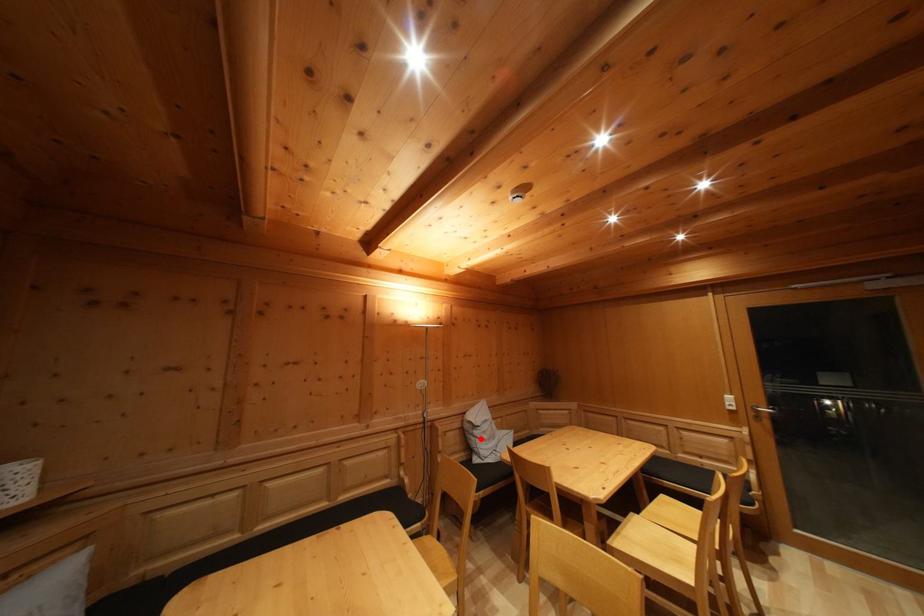
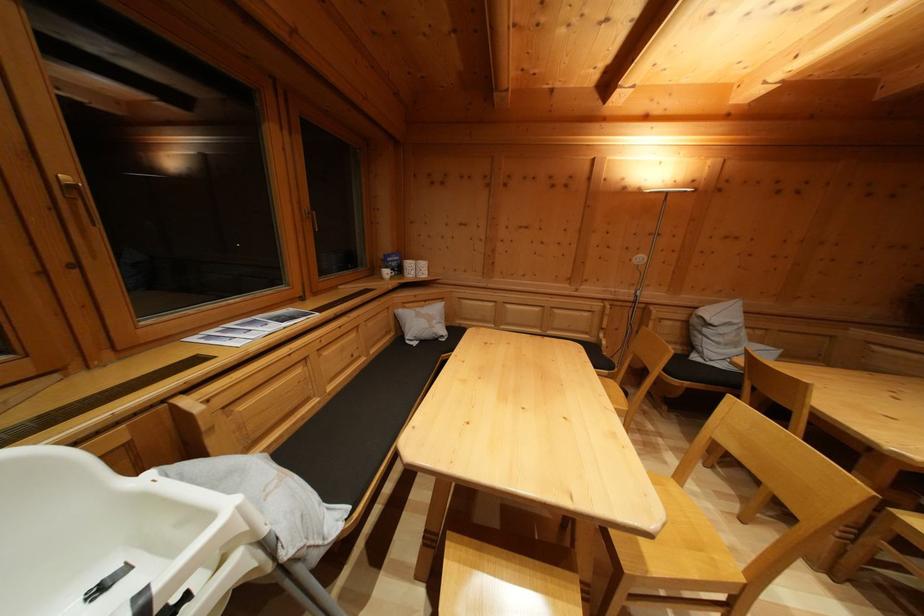
Question: I am providing you with two images of the same scene from different viewpoints. In image1, a red point is highlighted. Considering the same 3D point in image2, which of the following is correct?

Choices:
 (A) It is closer
 (B) It is farther

Answer: (A)